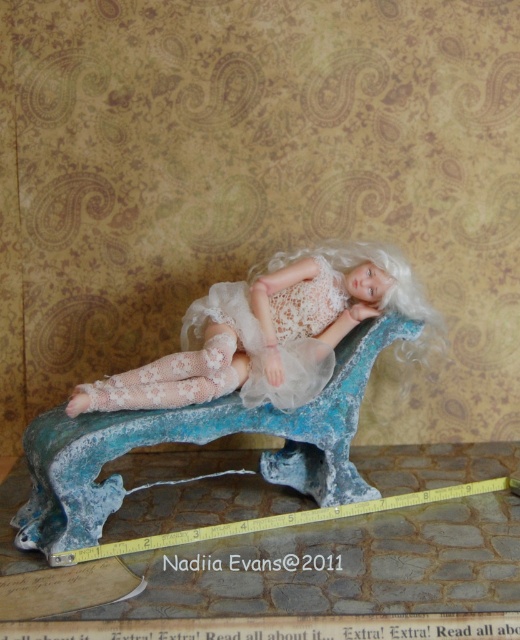
Question: Can you confirm if lace fabric doll at center is thinner than yellow rubber tape measure at lower center?

Choices:
 (A) yes
 (B) no

Answer: (A)

Question: Which object is the closest to the lace fabric doll at center?

Choices:
 (A) yellow rubber tape measure at lower center
 (B) white lace dress at center

Answer: (B)

Question: Can you confirm if white lace dress at center is positioned to the left of yellow rubber tape measure at lower center?

Choices:
 (A) no
 (B) yes

Answer: (B)

Question: Which point is farther to the camera?

Choices:
 (A) yellow rubber tape measure at lower center
 (B) lace fabric doll at center
 (C) white lace dress at center

Answer: (C)

Question: Can you confirm if white lace dress at center is positioned to the left of yellow rubber tape measure at lower center?

Choices:
 (A) no
 (B) yes

Answer: (B)

Question: Which of the following is the farthest from the observer?

Choices:
 (A) (242, 300)
 (B) (317, 513)

Answer: (A)